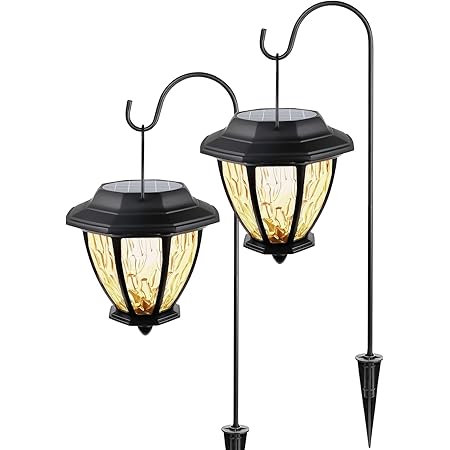
The width and height of the screenshot is (450, 450). Identify the location of hook. (136, 126).